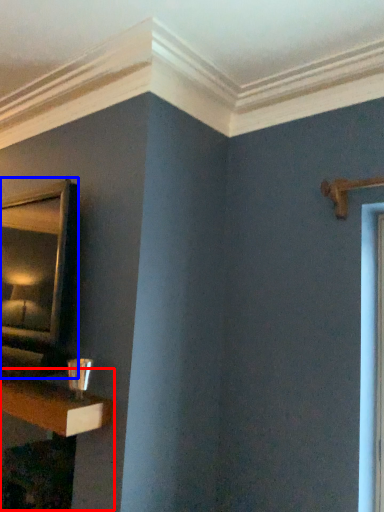
Question: Among these objects, which one is farthest to the camera, table (highlighted by a red box) or mirror (highlighted by a blue box)?

Choices:
 (A) table
 (B) mirror

Answer: (A)